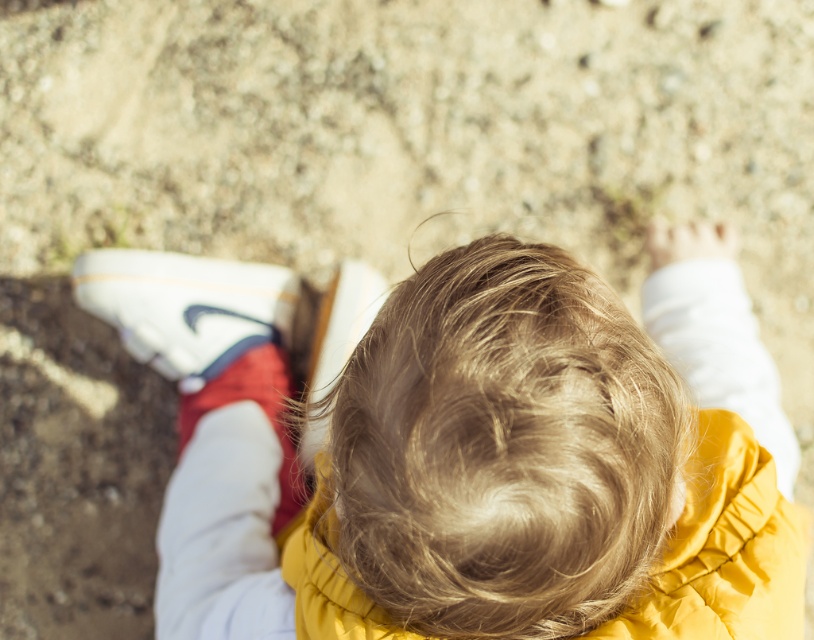
Is smooth yellow jacket at center taller than white leather shoe at lower left?

Correct, smooth yellow jacket at center is much taller as white leather shoe at lower left.

Is smooth yellow jacket at center above white leather shoe at lower left?

Incorrect, smooth yellow jacket at center is not positioned above white leather shoe at lower left.

Where is `smooth yellow jacket at center`? The height and width of the screenshot is (640, 814). smooth yellow jacket at center is located at coordinates (511, 467).